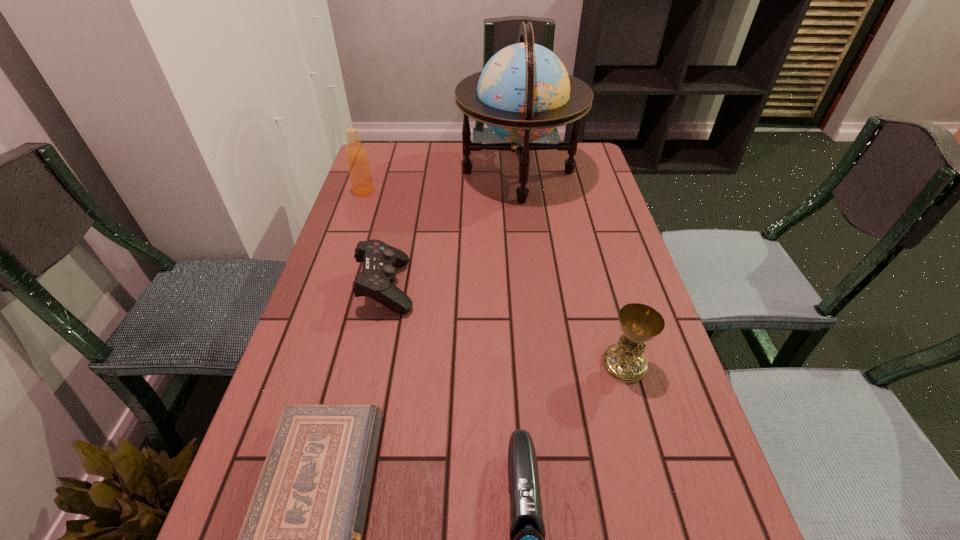
Locate an element on the screen. free space located 0.060m on the back of the chalice is located at coordinates (613, 325).

Where is `vacant space located on the front of the control`? vacant space located on the front of the control is located at coordinates 361,401.

Locate an element on the screen. The height and width of the screenshot is (540, 960). object located in the far edge section of the desktop is located at coordinates (524, 92).

Find the location of a particular element. beer bottle that is at the left edge is located at coordinates (356, 155).

The image size is (960, 540). Identify the location of control positioned at the left edge. (378, 275).

At what (x,y) coordinates should I click in order to perform the action: click on globe that is at the right edge. Please return your answer as a coordinate pair (x, y). Looking at the image, I should click on (524, 92).

Find the location of a particular element. chalice present at the right edge is located at coordinates (624, 361).

Image resolution: width=960 pixels, height=540 pixels. Identify the location of object situated at the far right corner. (524, 92).

At what (x,y) coordinates should I click in order to perform the action: click on free region at the far edge of the desktop. Please return your answer as a coordinate pair (x, y). Looking at the image, I should click on (419, 157).

Locate an element on the screen. Image resolution: width=960 pixels, height=540 pixels. vacant space at the left edge of the desktop is located at coordinates (360, 210).